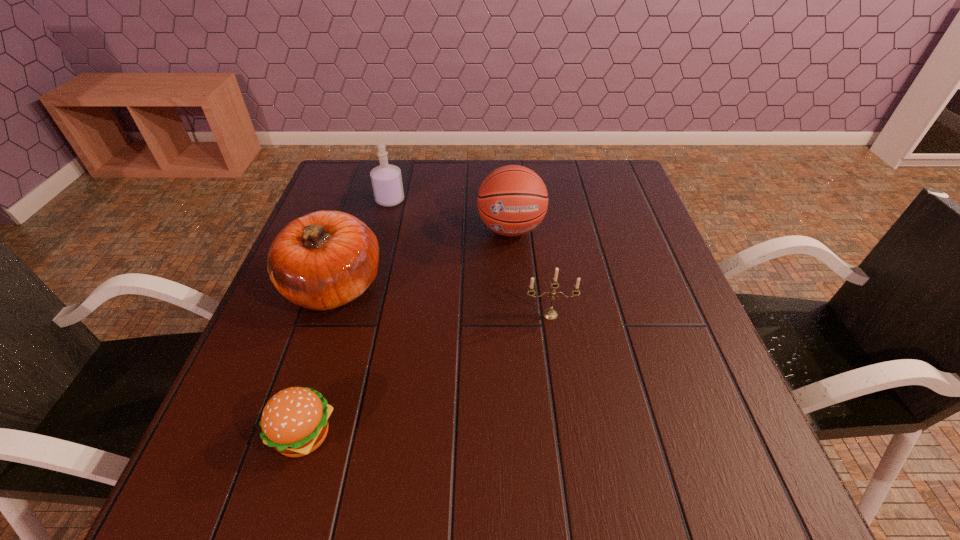
The width and height of the screenshot is (960, 540). What are the coordinates of `the fourth nearest object` in the screenshot? It's located at (512, 200).

At what (x,y) coordinates should I click in order to perform the action: click on pumpkin. Please return your answer as a coordinate pair (x, y). This screenshot has height=540, width=960. Looking at the image, I should click on (326, 259).

You are a GUI agent. You are given a task and a screenshot of the screen. Output one action in this format:
    pyautogui.click(x=<x>, y=<y>)
    Task: Click on the farthest object
    This screenshot has height=540, width=960.
    Given the screenshot: What is the action you would take?
    pyautogui.click(x=386, y=179)

Find the location of a particular element. Image resolution: width=960 pixels, height=540 pixels. the fourth tallest object is located at coordinates (549, 314).

Locate an element on the screen. hamburger is located at coordinates (294, 422).

The width and height of the screenshot is (960, 540). What are the coordinates of `the nearest object` in the screenshot? It's located at (294, 422).

Locate an element on the screen. free point located 0.050m on the logo side of the fourth nearest object is located at coordinates (514, 264).

At what (x,y) coordinates should I click in order to perform the action: click on vacant region located on the front of the pumpkin. Please return your answer as a coordinate pair (x, y). Looking at the image, I should click on (264, 491).

You are a GUI agent. You are given a task and a screenshot of the screen. Output one action in this format:
    pyautogui.click(x=<x>, y=<y>)
    Task: Click on the free location located on the right of the perfume
    This screenshot has width=960, height=540.
    Given the screenshot: What is the action you would take?
    [x=516, y=200]

Locate an element on the screen. vacant region located 0.080m on the back of the second shortest object is located at coordinates (545, 284).